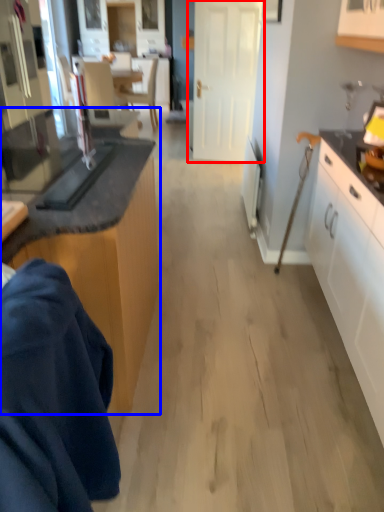
Question: Which point is further to the camera, door (highlighted by a red box) or cabinetry (highlighted by a blue box)?

Choices:
 (A) door
 (B) cabinetry

Answer: (A)